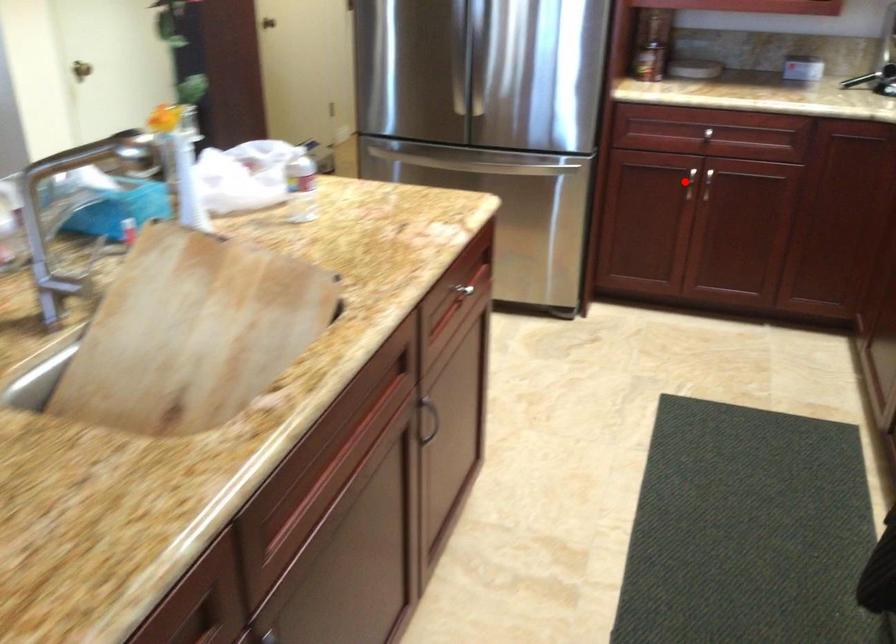
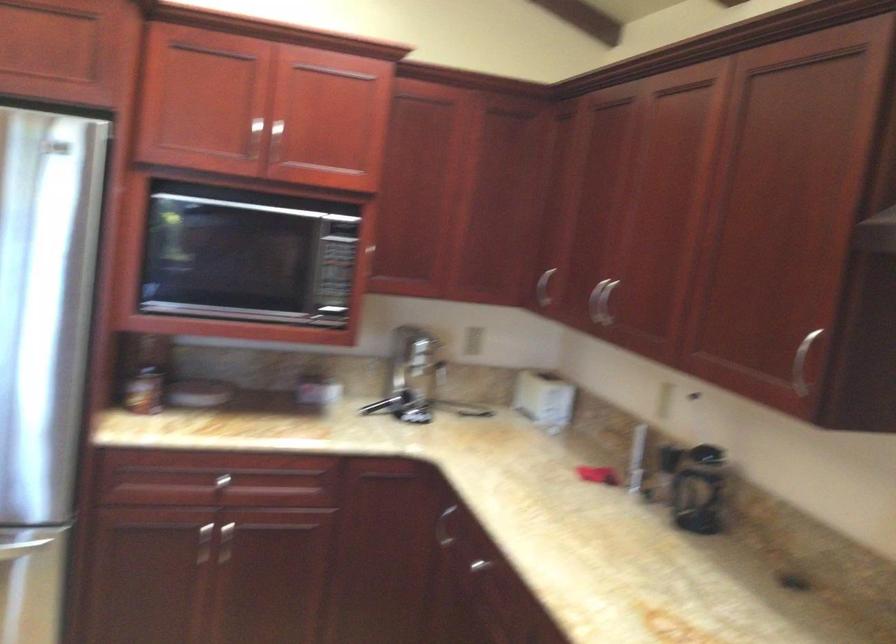
In the second image, find the point that corresponds to the highlighted location in the first image.

(203, 544)